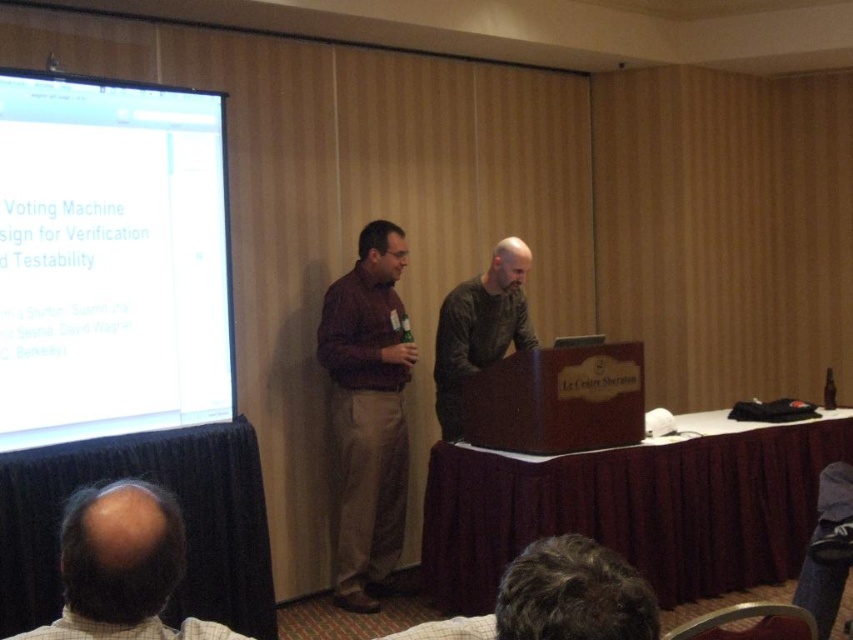
Question: Which point is farther to the camera?

Choices:
 (A) matte brown shirt at center
 (B) white glossy projector screen at upper left

Answer: (A)

Question: Is matte brown shirt at center further to the viewer compared to dark green sweater at center?

Choices:
 (A) yes
 (B) no

Answer: (A)

Question: Among these points, which one is farthest from the camera?

Choices:
 (A) (195, 252)
 (B) (454, 300)

Answer: (B)

Question: Can you confirm if white glossy projector screen at upper left is bigger than bald head at lower left?

Choices:
 (A) no
 (B) yes

Answer: (B)

Question: Which is farther from the matte brown shirt at center?

Choices:
 (A) white glossy projector screen at upper left
 (B) bald head at lower left
 (C) dark green sweater at center

Answer: (B)

Question: Does white glossy projector screen at upper left appear over dark green sweater at center?

Choices:
 (A) no
 (B) yes

Answer: (B)